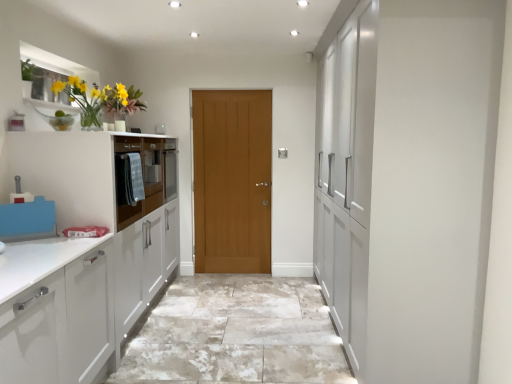
The width and height of the screenshot is (512, 384). Find the location of `vacant area to the right of light brown wooden door at center`. vacant area to the right of light brown wooden door at center is located at coordinates (271, 281).